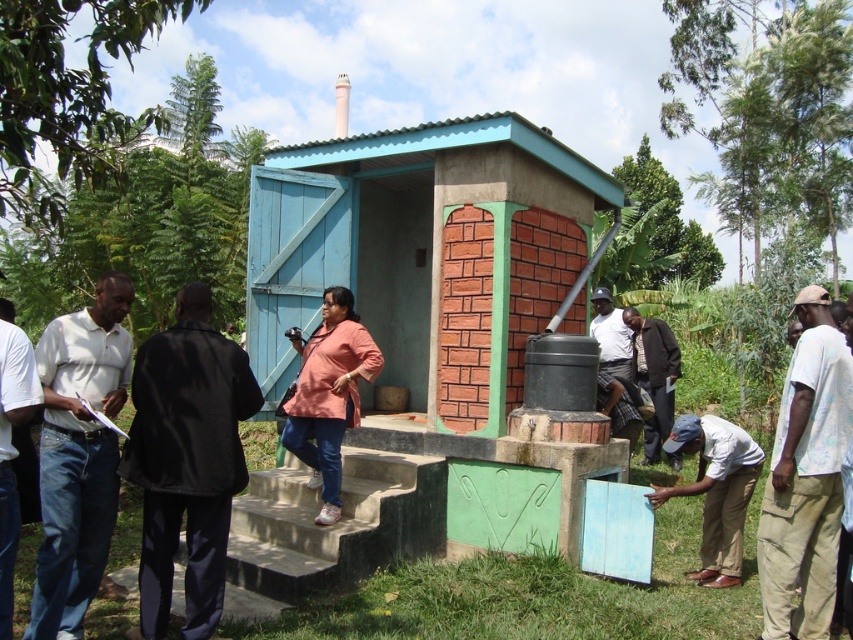
Question: Considering the relative positions of white shirt at left and light gray cotton shirt at lower right in the image provided, where is white shirt at left located with respect to light gray cotton shirt at lower right?

Choices:
 (A) below
 (B) above

Answer: (B)

Question: Which object appears closest to the camera in this image?

Choices:
 (A) black fabric jacket at left
 (B) white shirt at left
 (C) concrete/steps at center

Answer: (B)

Question: Which point is farther to the camera?

Choices:
 (A) (349, 461)
 (B) (683, 486)
 (C) (36, 625)

Answer: (A)

Question: Does khaki cotton pants at lower right have a lesser width compared to white shirt at center?

Choices:
 (A) no
 (B) yes

Answer: (A)

Question: Is white shirt at left thinner than khaki cotton pants at lower right?

Choices:
 (A) no
 (B) yes

Answer: (B)

Question: Based on their relative distances, which object is farther from the khaki cotton pants at lower right?

Choices:
 (A) white shirt at center
 (B) concrete/steps at center

Answer: (B)